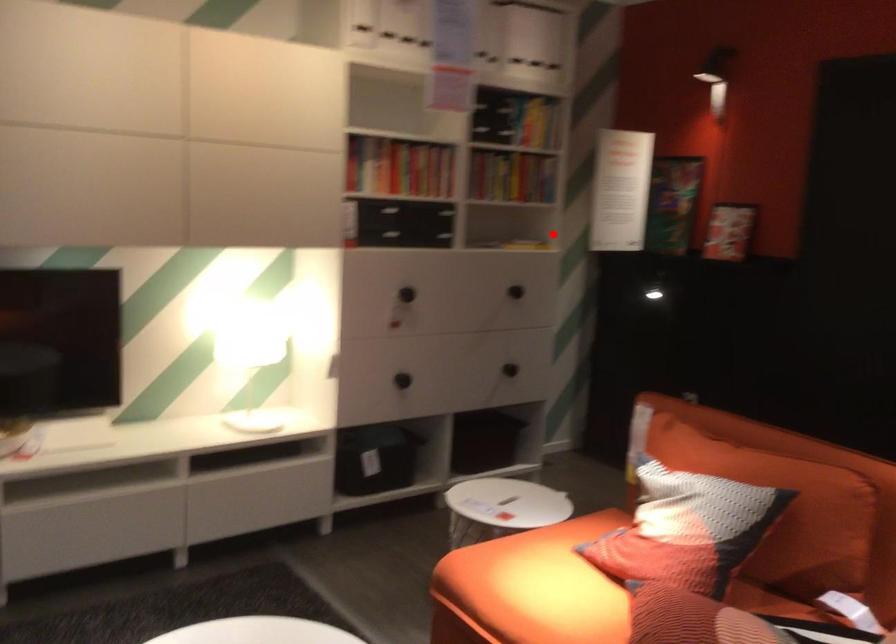
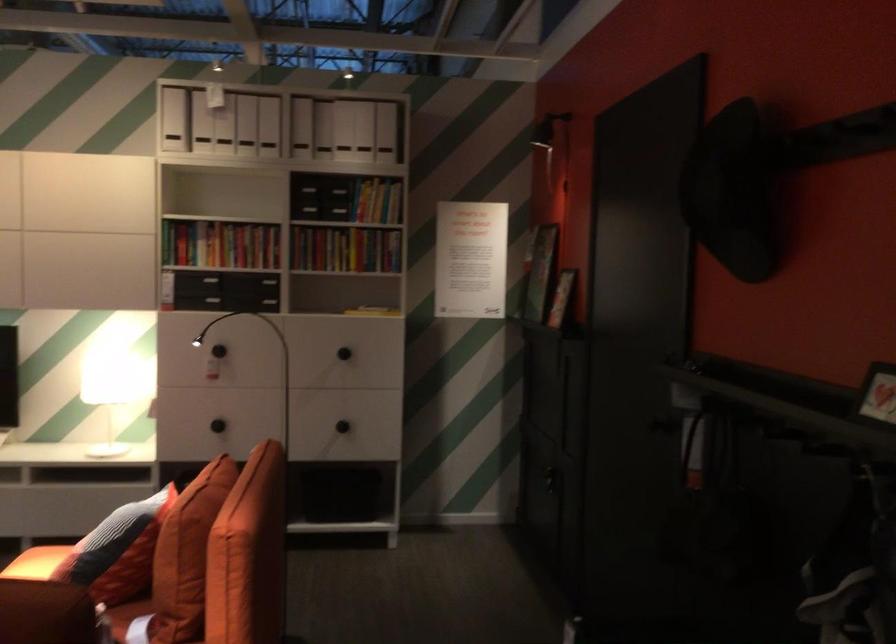
Find the pixel in the second image that matches the highlighted location in the first image.

(372, 310)